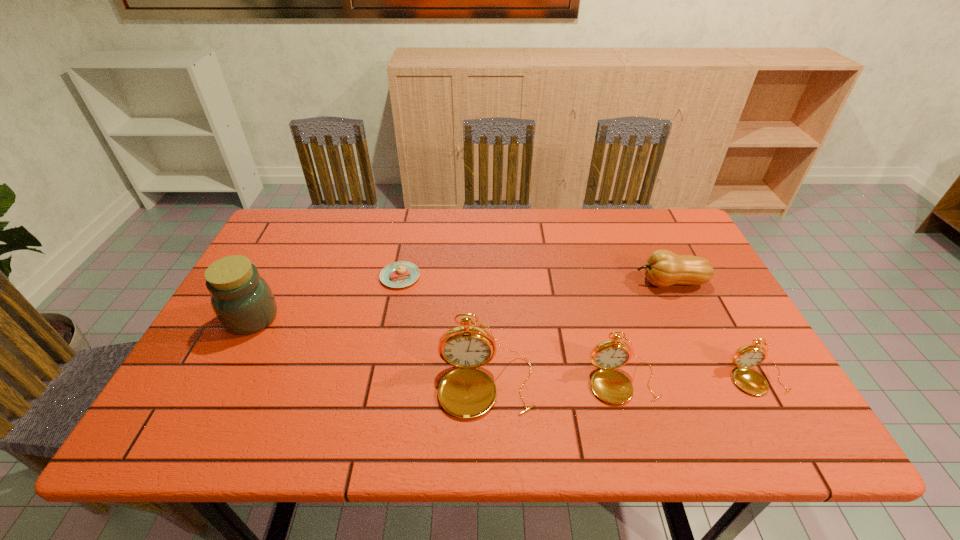
Image resolution: width=960 pixels, height=540 pixels. Find the location of `free space between the shortest pocket watch and the fourth nearest object`. free space between the shortest pocket watch and the fourth nearest object is located at coordinates (505, 348).

I want to click on empty location between the second shortest pocket watch and the pastry, so click(512, 329).

Select which object is the third closest to the jar. Please provide its 2D coordinates. Your answer should be formatted as a tuple, i.e. [(x, y)], where the tuple contains the x and y coordinates of a point satisfying the conditions above.

[(611, 386)]

The height and width of the screenshot is (540, 960). What are the coordinates of `object identified as the closest to the shortest pocket watch` in the screenshot? It's located at (611, 386).

Identify the location of pocket watch that can be found as the closest to the shortest pocket watch. The image size is (960, 540). (611, 386).

Identify which pocket watch is the second nearest to the second object from left to right. Please provide its 2D coordinates. Your answer should be formatted as a tuple, i.e. [(x, y)], where the tuple contains the x and y coordinates of a point satisfying the conditions above.

[(611, 386)]